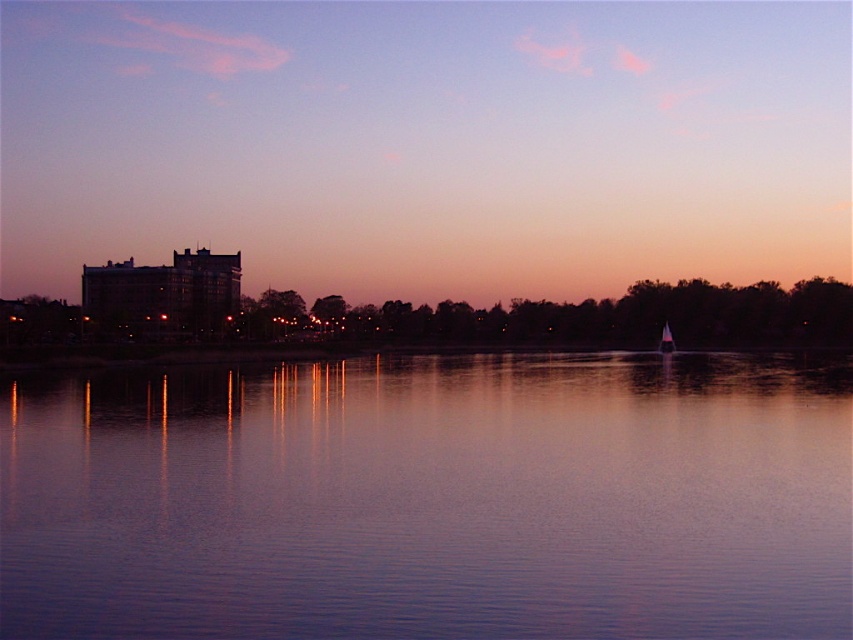
Question: Is purple glass building at upper left positioned in front of purple reflective water at center?

Choices:
 (A) yes
 (B) no

Answer: (B)

Question: Is purple glass building at upper left bigger than white glossy sailboat at center?

Choices:
 (A) no
 (B) yes

Answer: (B)

Question: Which of the following is the farthest from the observer?

Choices:
 (A) (683, 273)
 (B) (280, 588)

Answer: (A)

Question: Does purple reflective water at center have a larger size compared to white glossy sailboat at center?

Choices:
 (A) yes
 (B) no

Answer: (A)

Question: Which object is the closest to the purple reflective water at center?

Choices:
 (A) white glossy sailboat at center
 (B) purple glass building at upper left

Answer: (A)

Question: Which of the following is the closest to the observer?

Choices:
 (A) white glossy sailboat at center
 (B) purple reflective water at center

Answer: (B)